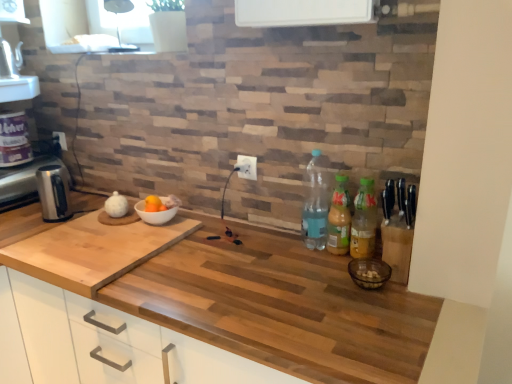
You are a GUI agent. You are given a task and a screenshot of the screen. Output one action in this format:
    pyautogui.click(x=<x>, y=<y>)
    Task: Click on the translucent plastic bottle at right, which ranks as the 1th bottle in left-to-right order
    
    Given the screenshot: What is the action you would take?
    pyautogui.click(x=315, y=204)

What do you see at coordinates (136, 24) in the screenshot? The image size is (512, 384). I see `transparent glass window at upper left` at bounding box center [136, 24].

What is the approximate height of transparent glass window at upper left?

transparent glass window at upper left is 8.28 inches tall.

What do you see at coordinates (53, 193) in the screenshot? This screenshot has height=384, width=512. I see `satin silver kettle at left` at bounding box center [53, 193].

Image resolution: width=512 pixels, height=384 pixels. Identify the location of white plastic electric outlet at center, which is the second electric outlet from top to bottom. (246, 167).

Describe the element at coordinates (82, 245) in the screenshot. I see `natural wood cutting board at left, marked as the 2th countertop in a bottom-to-top arrangement` at that location.

What is the approximate width of green plastic bottles at right, which appears as the third bottle when viewed from the left?

green plastic bottles at right, which appears as the third bottle when viewed from the left, is 2.86 inches wide.

Image resolution: width=512 pixels, height=384 pixels. Find the location of `translucent plastic bottle at right, which is the third bottle in right-to-left order`. translucent plastic bottle at right, which is the third bottle in right-to-left order is located at coordinates (315, 204).

Considering the positions of objects transparent glass window at upper left and satin silver kettle at left in the image provided, who is more to the left, transparent glass window at upper left or satin silver kettle at left?

Positioned to the left is satin silver kettle at left.

From their relative heights in the image, would you say transparent glass window at upper left is taller or shorter than satin silver kettle at left?

Considering their sizes, transparent glass window at upper left has less height than satin silver kettle at left.

Is transparent glass window at upper left directly adjacent to satin silver kettle at left?

They are not placed beside each other.

From a real-world perspective, is white plastic electric outlet at center, the second electric outlet positioned from the back, located beneath white plastic electric outlet at upper center, marked as the first electric outlet in a back-to-front arrangement?

No, from a real-world perspective, white plastic electric outlet at center, the second electric outlet positioned from the back, is not beneath white plastic electric outlet at upper center, marked as the first electric outlet in a back-to-front arrangement.

In the image, is white plastic electric outlet at center, arranged as the first electric outlet when viewed from the right, positioned in front of or behind white plastic electric outlet at upper center, the second electric outlet from the front?

white plastic electric outlet at center, arranged as the first electric outlet when viewed from the right, is positioned closer to the viewer than white plastic electric outlet at upper center, the second electric outlet from the front.

Which of these two, white plastic electric outlet at center, the second electric outlet positioned from the left, or white plastic electric outlet at upper center, the second electric outlet from the front, stands shorter?

With less height is white plastic electric outlet at upper center, the second electric outlet from the front.

Locate an element on the screen. The image size is (512, 384). electric outlet that appears below the white plastic electric outlet at upper center, the 1th electric outlet from the top (from the image's perspective) is located at coordinates (246, 167).

Is point (49, 183) positioned after point (319, 245)?

Yes, it is.

Which of these two, satin silver kettle at left or translucent plastic bottle at right, which ranks as the 1th bottle in left-to-right order, stands taller?

With more height is translucent plastic bottle at right, which ranks as the 1th bottle in left-to-right order.

Considering the relative sizes of satin silver kettle at left and translucent plastic bottle at right, which is the third bottle in right-to-left order, in the image provided, is satin silver kettle at left bigger than translucent plastic bottle at right, which is the third bottle in right-to-left order,?

Indeed, satin silver kettle at left has a larger size compared to translucent plastic bottle at right, which is the third bottle in right-to-left order.

From the picture: Which object is further away from the camera, satin silver kettle at left or translucent plastic bottle at right, which ranks as the 1th bottle in left-to-right order?

satin silver kettle at left is further away from the camera.

Between translucent plastic bottles at right, which is the 2th bottle in left-to-right order, and satin silver kettle at left, which one has larger width?

satin silver kettle at left.

At what (x,y) coordinates should I click in order to perform the action: click on appliance below the translucent plastic bottles at right, which is the 2th bottle in left-to-right order (from a real-world perspective). Please return your answer as a coordinate pair (x, y). This screenshot has height=384, width=512. Looking at the image, I should click on (24, 182).

Who is taller, translucent plastic bottles at right, which is the 2th bottle in left-to-right order, or satin silver kettle at left?

Standing taller between the two is translucent plastic bottles at right, which is the 2th bottle in left-to-right order.

Considering the relative positions of translucent plastic bottles at right, which is the 2th bottle in left-to-right order, and satin silver kettle at left in the image provided, is translucent plastic bottles at right, which is the 2th bottle in left-to-right order, behind satin silver kettle at left?

No, translucent plastic bottles at right, which is the 2th bottle in left-to-right order, is closer to the viewer.

Would you say natural wood cutting board at left, marked as the 2th countertop in a bottom-to-top arrangement, contains white plastic electric outlet at upper center, marked as the first electric outlet in a back-to-front arrangement?

No, white plastic electric outlet at upper center, marked as the first electric outlet in a back-to-front arrangement, is not a part of natural wood cutting board at left, marked as the 2th countertop in a bottom-to-top arrangement.

How far apart are natural wood cutting board at left, marked as the 2th countertop in a bottom-to-top arrangement, and white plastic electric outlet at upper center, marked as the first electric outlet in a back-to-front arrangement?

natural wood cutting board at left, marked as the 2th countertop in a bottom-to-top arrangement, is 30.28 inches from white plastic electric outlet at upper center, marked as the first electric outlet in a back-to-front arrangement.

Can you confirm if natural wood cutting board at left, which appears as the first countertop when viewed from the top, is wider than white plastic electric outlet at upper center, the second electric outlet from the front?

Correct, the width of natural wood cutting board at left, which appears as the first countertop when viewed from the top, exceeds that of white plastic electric outlet at upper center, the second electric outlet from the front.

Can you tell me how much natural wood cutting board at left, which appears as the first countertop when viewed from the top, and white plastic electric outlet at upper center, the second electric outlet positioned from the bottom, differ in facing direction?

2.65 degrees.

Which is closer, (57, 135) or (49, 198)?

Point (57, 135) is positioned farther from the camera compared to point (49, 198).

Which of these two, white plastic electric outlet at upper center, the 1th electric outlet from the top, or satin silver kettle at left, stands shorter?

Standing shorter between the two is white plastic electric outlet at upper center, the 1th electric outlet from the top.

Does white plastic electric outlet at upper center, the second electric outlet from the front, have a smaller size compared to satin silver kettle at left?

Yes.

Measure the distance from white plastic electric outlet at upper center, the second electric outlet positioned from the bottom, to satin silver kettle at left.

white plastic electric outlet at upper center, the second electric outlet positioned from the bottom, and satin silver kettle at left are 17.69 inches apart from each other.

Which object is further away from the camera, translucent plastic bottle at right, which ranks as the 1th bottle in left-to-right order, or satin silver kettle at left?

satin silver kettle at left is behind.

From the image's perspective, which object appears higher, translucent plastic bottle at right, which ranks as the 1th bottle in left-to-right order, or satin silver kettle at left?

satin silver kettle at left appears higher in the image.

Locate an element on the screen. window screen behind the satin silver kettle at left is located at coordinates (136, 24).

The image size is (512, 384). I want to click on electric outlet located on the right of white plastic electric outlet at upper center, which is the second electric outlet from right to left, so click(246, 167).

Based on their spatial positions, is translucent plastic bottles at right, acting as the 2th bottle starting from the right, or satin silver kettle at left closer to natural wood cutting board at left, marked as the 2th countertop in a bottom-to-top arrangement?

satin silver kettle at left lies closer to natural wood cutting board at left, marked as the 2th countertop in a bottom-to-top arrangement, than the other object.

In the scene shown: Considering their positions, is satin silver kettle at left positioned further to natural wood cutting board at left, marked as the 2th countertop in a bottom-to-top arrangement, than transparent glass window at upper left?

transparent glass window at upper left is further to natural wood cutting board at left, marked as the 2th countertop in a bottom-to-top arrangement.

Considering their positions, is wooden at center, which is the 1th countertop in bottom-to-top order, positioned further to natural wood cutting board at left, which appears as the first countertop when viewed from the top, than transparent glass window at upper left?

The object further to natural wood cutting board at left, which appears as the first countertop when viewed from the top, is transparent glass window at upper left.

Looking at the image, which one is located closer to translucent plastic bottles at right, which is the 2th bottle in left-to-right order, satin silver kettle at left or white plastic electric outlet at center, the second electric outlet positioned from the left?

white plastic electric outlet at center, the second electric outlet positioned from the left.

Estimate the real-world distances between objects in this image. Which object is further from green plastic bottles at right, which appears as the third bottle when viewed from the left, satin silver kettle at left or natural wood cutting board at left, which appears as the first countertop when viewed from the top?

satin silver kettle at left is positioned further to the anchor green plastic bottles at right, which appears as the third bottle when viewed from the left.

Estimate the real-world distances between objects in this image. Which object is closer to translucent plastic bottles at right, which is the 2th bottle in left-to-right order, natural wood cutting board at left, which appears as the first countertop when viewed from the top, or green plastic bottles at right, which appears as the third bottle when viewed from the left?

The object closer to translucent plastic bottles at right, which is the 2th bottle in left-to-right order, is green plastic bottles at right, which appears as the third bottle when viewed from the left.

Estimate the real-world distances between objects in this image. Which object is closer to white plastic electric outlet at upper center, which is the second electric outlet from right to left, satin silver kettle at left or wooden at center, marked as the 2th countertop in a top-to-bottom arrangement?

Among the two, satin silver kettle at left is located nearer to white plastic electric outlet at upper center, which is the second electric outlet from right to left.

Estimate the real-world distances between objects in this image. Which object is further from wooden at center, marked as the 2th countertop in a top-to-bottom arrangement, satin silver kettle at left or natural wood cutting board at left, marked as the 2th countertop in a bottom-to-top arrangement?

The object further to wooden at center, marked as the 2th countertop in a top-to-bottom arrangement, is satin silver kettle at left.

Where is `coffee machine between white plastic electric outlet at upper center, the second electric outlet from the front, and white plastic electric outlet at center, arranged as the first electric outlet when viewed from the right, from left to right`? This screenshot has width=512, height=384. coffee machine between white plastic electric outlet at upper center, the second electric outlet from the front, and white plastic electric outlet at center, arranged as the first electric outlet when viewed from the right, from left to right is located at coordinates (53, 193).

Image resolution: width=512 pixels, height=384 pixels. I want to click on countertop between transparent glass window at upper left and wooden at center, marked as the 2th countertop in a top-to-bottom arrangement, vertically, so click(82, 245).

Where is `appliance between natural wood cutting board at left, which appears as the first countertop when viewed from the top, and white plastic electric outlet at upper center, marked as the first electric outlet in a back-to-front arrangement, along the z-axis`? This screenshot has height=384, width=512. appliance between natural wood cutting board at left, which appears as the first countertop when viewed from the top, and white plastic electric outlet at upper center, marked as the first electric outlet in a back-to-front arrangement, along the z-axis is located at coordinates [24, 182].

Find the location of `window screen located between satin silver kettle at left and white plastic electric outlet at center, arranged as the first electric outlet when viewed from the right, in the left-right direction`. window screen located between satin silver kettle at left and white plastic electric outlet at center, arranged as the first electric outlet when viewed from the right, in the left-right direction is located at coordinates (136, 24).